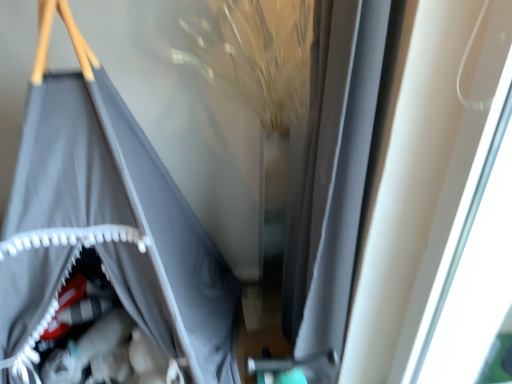
The width and height of the screenshot is (512, 384). I want to click on matte gray fabric at left, so click(122, 207).

The image size is (512, 384). Describe the element at coordinates (122, 207) in the screenshot. I see `matte gray fabric at left` at that location.

Describe the element at coordinates (440, 204) in the screenshot. I see `white plastic window at upper right` at that location.

The image size is (512, 384). In order to click on white plastic window at upper right in this screenshot , I will do `click(440, 204)`.

Where is `matte gray fabric at left`? This screenshot has width=512, height=384. matte gray fabric at left is located at coordinates (122, 207).

Considering the relative positions of matte gray fabric at left and white plastic window at upper right in the image provided, is matte gray fabric at left to the right of white plastic window at upper right from the viewer's perspective?

Incorrect, matte gray fabric at left is not on the right side of white plastic window at upper right.

Considering their positions, is matte gray fabric at left located in front of or behind white plastic window at upper right?

Clearly, matte gray fabric at left is behind white plastic window at upper right.

Which point is more forward, (60, 145) or (485, 116)?

Positioned in front is point (485, 116).

From the image's perspective, is matte gray fabric at left under white plastic window at upper right?

No, from the image's perspective, matte gray fabric at left is not beneath white plastic window at upper right.

From a real-world perspective, does matte gray fabric at left stand above white plastic window at upper right?

No.

Between matte gray fabric at left and white plastic window at upper right, which one has larger width?

Wider between the two is matte gray fabric at left.

From their relative heights in the image, would you say matte gray fabric at left is taller or shorter than white plastic window at upper right?

Clearly, matte gray fabric at left is taller compared to white plastic window at upper right.

Which of these two, matte gray fabric at left or white plastic window at upper right, is smaller?

white plastic window at upper right.

Is matte gray fabric at left spatially inside white plastic window at upper right, or outside of it?

matte gray fabric at left is located beyond the bounds of white plastic window at upper right.

Can you see matte gray fabric at left touching white plastic window at upper right?

No, matte gray fabric at left is not touching white plastic window at upper right.

Does matte gray fabric at left turn towards white plastic window at upper right?

No.

What's the angular difference between matte gray fabric at left and white plastic window at upper right's facing directions?

89.1 degrees separate the facing orientations of matte gray fabric at left and white plastic window at upper right.

This screenshot has height=384, width=512. I want to click on window positioned vertically above the matte gray fabric at left (from a real-world perspective), so click(x=440, y=204).

Based on their positions, is white plastic window at upper right located to the left or right of matte gray fabric at left?

Clearly, white plastic window at upper right is on the right of matte gray fabric at left in the image.

Consider the image. Does white plastic window at upper right lie in front of matte gray fabric at left?

Yes, it is in front of matte gray fabric at left.

Is point (387, 310) positioned in front of point (66, 75)?

No, it is behind (66, 75).

From the image's perspective, which one is positioned higher, white plastic window at upper right or matte gray fabric at left?

From the image's view, matte gray fabric at left is above.

From a real-world perspective, between white plastic window at upper right and matte gray fabric at left, who is vertically higher?

white plastic window at upper right.

Consider the image. Is white plastic window at upper right wider or thinner than matte gray fabric at left?

white plastic window at upper right is thinner than matte gray fabric at left.

Does white plastic window at upper right have a greater height compared to matte gray fabric at left?

In fact, white plastic window at upper right may be shorter than matte gray fabric at left.

Between white plastic window at upper right and matte gray fabric at left, which one has larger size?

With larger size is matte gray fabric at left.

Is matte gray fabric at left completely or partially inside white plastic window at upper right?

No, matte gray fabric at left is located outside of white plastic window at upper right.

Can you see white plastic window at upper right touching matte gray fabric at left?

There is a gap between white plastic window at upper right and matte gray fabric at left.

Consider the image. Is white plastic window at upper right looking in the opposite direction of matte gray fabric at left?

white plastic window at upper right is not turned away from matte gray fabric at left.

How many degrees apart are the facing directions of white plastic window at upper right and matte gray fabric at left?

white plastic window at upper right and matte gray fabric at left are facing 89.1 degrees away from each other.

Identify the location of curtain above the white plastic window at upper right (from the image's perspective). This screenshot has height=384, width=512. (122, 207).

Where is `window located below the matte gray fabric at left (from the image's perspective)`? window located below the matte gray fabric at left (from the image's perspective) is located at coordinates (440, 204).

At what (x,y) coordinates should I click in order to perform the action: click on curtain above the white plastic window at upper right (from the image's perspective). Please return your answer as a coordinate pair (x, y). The width and height of the screenshot is (512, 384). Looking at the image, I should click on (122, 207).